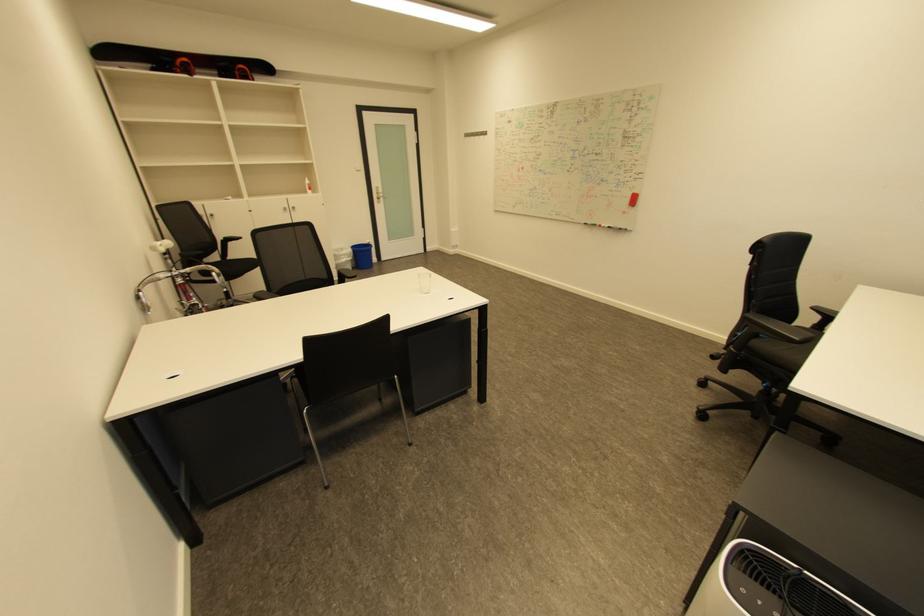
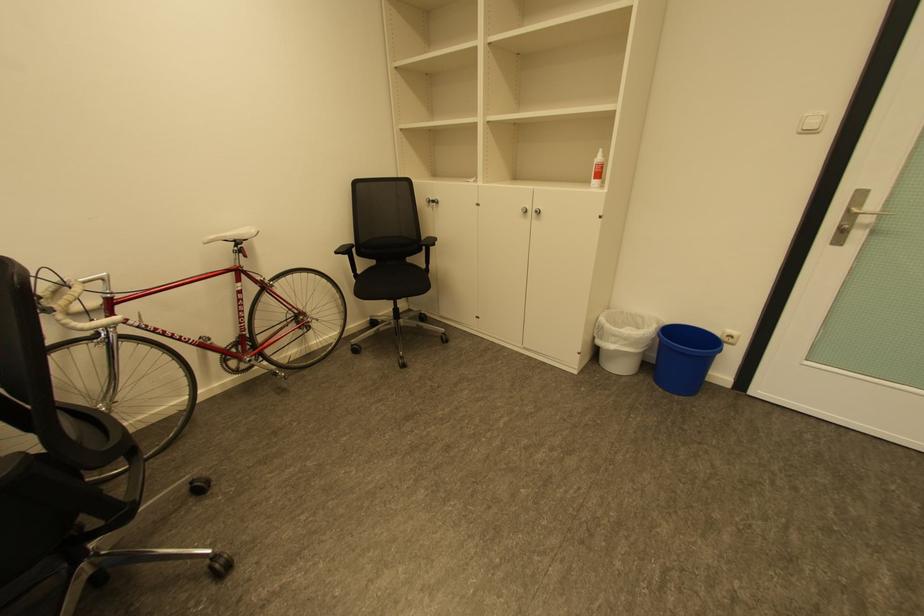
Locate, in the second image, the point that corresponds to pixel 377 244 in the first image.

(737, 337)